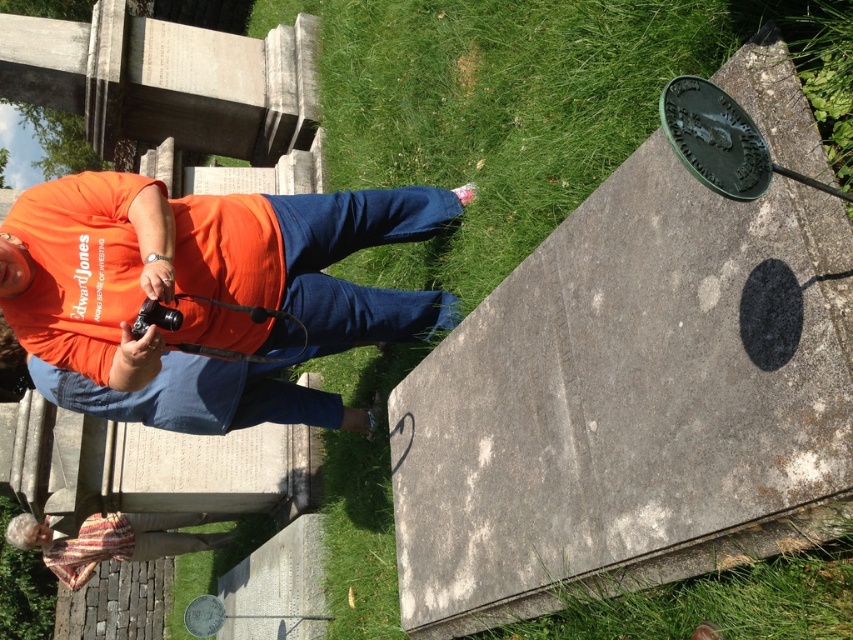
Does orange cotton shirt at center appear over striped fabric at lower left?

Correct, orange cotton shirt at center is located above striped fabric at lower left.

Does orange cotton shirt at center have a greater width compared to striped fabric at lower left?

In fact, orange cotton shirt at center might be narrower than striped fabric at lower left.

The width and height of the screenshot is (853, 640). Identify the location of orange cotton shirt at center. (131, 323).

Which of these two, gray stone marker at upper right or striped fabric at lower left, stands shorter?

With less height is striped fabric at lower left.

Can you confirm if gray stone marker at upper right is wider than striped fabric at lower left?

No.

Between point (509, 388) and point (16, 525), which one is positioned behind?

Point (16, 525)

The image size is (853, 640). Identify the location of gray stone marker at upper right. (630, 403).

Who is more distant from viewer, (579, 240) or (386, 218)?

The point (386, 218) is more distant.

Is gray stone marker at upper right to the right of orange cotton shirt at center from the viewer's perspective?

Yes, gray stone marker at upper right is to the right of orange cotton shirt at center.

Who is more forward, (476,451) or (259,234)?

Point (476,451)

At what (x,y) coordinates should I click in order to perform the action: click on gray stone marker at upper right. Please return your answer as a coordinate pair (x, y). The width and height of the screenshot is (853, 640). Looking at the image, I should click on (630, 403).